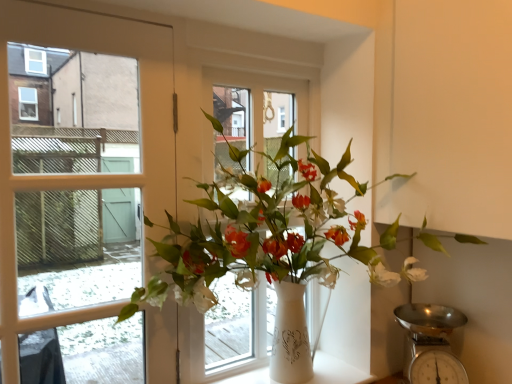
What is the approximate height of white ceramic vase at center?

white ceramic vase at center is 0.96 inches in height.

This screenshot has width=512, height=384. What are the coordinates of `white ceramic vase at center` in the screenshot? It's located at (336, 371).

Does point (281, 86) come in front of point (371, 248)?

No, it is not.

From a real-world perspective, is white plastic window frame at center below white glossy vase at center?

No, from a real-world perspective, white plastic window frame at center is not beneath white glossy vase at center.

Which of these two, white plastic window frame at center or white glossy vase at center, stands shorter?

white glossy vase at center is shorter.

Locate an element on the screen. The image size is (512, 384). window frame that appears above the white glossy vase at center (from a real-world perspective) is located at coordinates point(253,109).

Is white glossy vase at center aimed at white ceramic vase at center?

No.

In the image, is white glossy vase at center positioned in front of or behind white ceramic vase at center?

white glossy vase at center is positioned closer to the viewer than white ceramic vase at center.

Based on the photo, is white glossy vase at center completely or partially outside of white ceramic vase at center?

Absolutely, white glossy vase at center is external to white ceramic vase at center.

In terms of size, does white glossy vase at center appear bigger or smaller than white ceramic vase at center?

Considering their sizes, white glossy vase at center takes up more space than white ceramic vase at center.

From the image's perspective, between metallic silver scale at lower right and white plastic window frame at center, which one is located above?

white plastic window frame at center is shown above in the image.

Which object is wider, metallic silver scale at lower right or white plastic window frame at center?

With larger width is metallic silver scale at lower right.

In the scene shown: Are metallic silver scale at lower right and white plastic window frame at center located far from each other?

That's not correct — metallic silver scale at lower right is a little close to white plastic window frame at center.

From a real-world perspective, does metallic silver scale at lower right sit lower than white plastic window frame at center?

Correct, in the physical world, metallic silver scale at lower right is lower than white plastic window frame at center.

Identify the location of window sill on the left of metallic silver scale at lower right. [336, 371].

Who is shorter, white ceramic vase at center or metallic silver scale at lower right?

white ceramic vase at center is shorter.

Based on the photo, which object is positioned more to the left, white ceramic vase at center or metallic silver scale at lower right?

Positioned to the left is white ceramic vase at center.

Considering the relative sizes of white glossy vase at center and metallic silver scale at lower right in the image provided, is white glossy vase at center smaller than metallic silver scale at lower right?

No.

Is the surface of white glossy vase at center in direct contact with metallic silver scale at lower right?

No, white glossy vase at center is not with metallic silver scale at lower right.

Between point (231, 152) and point (404, 374), which one is positioned behind?

The point (404, 374) is behind.

I want to click on scale that is behind the white glossy vase at center, so click(430, 343).

Can you tell me how much white ceramic vase at center and white plastic window frame at center differ in facing direction?

white ceramic vase at center and white plastic window frame at center are facing 0.000287 degrees away from each other.

Does white ceramic vase at center have a larger size compared to white plastic window frame at center?

Actually, white ceramic vase at center might be smaller than white plastic window frame at center.

Between white ceramic vase at center and white plastic window frame at center, which one has smaller width?

white plastic window frame at center is thinner.

The image size is (512, 384). In order to click on window frame above the white ceramic vase at center (from a real-world perspective) in this screenshot , I will do `click(253, 109)`.

Is the position of white ceramic vase at center more distant than that of white glossy vase at center?

Yes, white ceramic vase at center is further from the viewer.

Could you tell me if white ceramic vase at center is turned towards white glossy vase at center?

No, white ceramic vase at center does not turn towards white glossy vase at center.

Between white ceramic vase at center and white glossy vase at center, which one has less height?

white ceramic vase at center is shorter.

Is point (316, 359) farther from camera compared to point (231, 152)?

Yes, point (316, 359) is behind point (231, 152).

At what (x,y) coordinates should I click in order to perform the action: click on window frame on the left side of white glossy vase at center. Please return your answer as a coordinate pair (x, y). The width and height of the screenshot is (512, 384). Looking at the image, I should click on (253, 109).

Where is `window sill on the right side of white glossy vase at center`? window sill on the right side of white glossy vase at center is located at coordinates (336, 371).

Looking at the image, which one is located closer to white plastic window frame at center, white glossy vase at center or metallic silver scale at lower right?

Based on the image, white glossy vase at center appears to be nearer to white plastic window frame at center.

From the picture: When comparing their distances from white glossy vase at center, does white plastic window frame at center or metallic silver scale at lower right seem further?

metallic silver scale at lower right is positioned further to the anchor white glossy vase at center.

Looking at the image, which one is located further to white plastic window frame at center, white ceramic vase at center or metallic silver scale at lower right?

white ceramic vase at center is positioned further to the anchor white plastic window frame at center.

When comparing their distances from white glossy vase at center, does white ceramic vase at center or white plastic window frame at center seem closer?

Based on the image, white plastic window frame at center appears to be nearer to white glossy vase at center.

Estimate the real-world distances between objects in this image. Which object is closer to white ceramic vase at center, white plastic window frame at center or white glossy vase at center?

Result: white glossy vase at center is positioned closer to the anchor white ceramic vase at center.

Looking at the image, which one is located further to white glossy vase at center, white plastic window frame at center or white ceramic vase at center?

white ceramic vase at center lies further to white glossy vase at center than the other object.

Which object lies nearer to the anchor point white glossy vase at center, metallic silver scale at lower right or white ceramic vase at center?

Among the two, metallic silver scale at lower right is located nearer to white glossy vase at center.

Estimate the real-world distances between objects in this image. Which object is closer to metallic silver scale at lower right, white plastic window frame at center or white ceramic vase at center?

white ceramic vase at center is closer to metallic silver scale at lower right.

Identify the location of window sill between white glossy vase at center and white plastic window frame at center in the front-back direction. The width and height of the screenshot is (512, 384). (336, 371).

The width and height of the screenshot is (512, 384). In order to click on window sill located between white glossy vase at center and metallic silver scale at lower right in the depth direction in this screenshot , I will do `click(336, 371)`.

This screenshot has height=384, width=512. What are the coordinates of `scale between white plastic window frame at center and white ceramic vase at center in the up-down direction` in the screenshot? It's located at (430, 343).

This screenshot has height=384, width=512. Find the location of `scale positioned between white glossy vase at center and white plastic window frame at center from near to far`. scale positioned between white glossy vase at center and white plastic window frame at center from near to far is located at coordinates (430, 343).